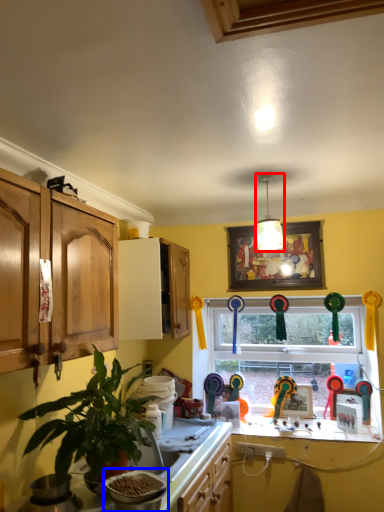
Question: Which of the following is the closest to the observer, light fixture (highlighted by a red box) or appliance (highlighted by a blue box)?

Choices:
 (A) light fixture
 (B) appliance

Answer: (B)